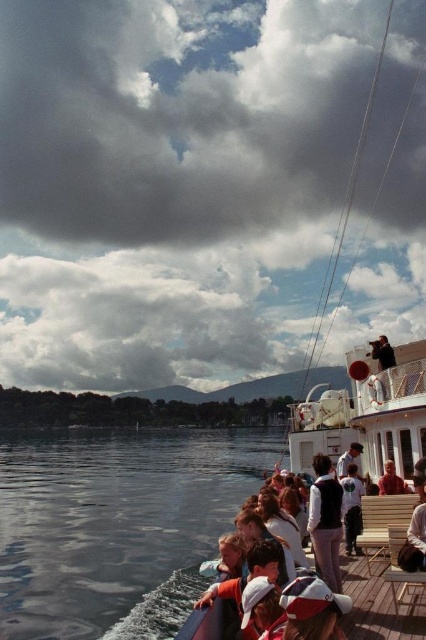
Question: Which object is the farthest from the clear water at lower left?

Choices:
 (A) wooden deck boat at center
 (B) wooden deck at center
 (C) white cotton shirt at center
 (D) red velvet coat at center

Answer: (D)

Question: Is clear water at lower left smaller than red velvet coat at center?

Choices:
 (A) no
 (B) yes

Answer: (A)

Question: Which of these objects is positioned farthest from the wooden deck boat at center?

Choices:
 (A) white cotton shirt at center
 (B) wooden deck at center
 (C) clear water at lower left

Answer: (C)

Question: Does wooden deck boat at center have a smaller size compared to white cotton shirt at center?

Choices:
 (A) no
 (B) yes

Answer: (A)

Question: Which of the following is the closest to the observer?

Choices:
 (A) (388, 483)
 (B) (215, 509)
 (C) (420, 604)
 (D) (340, 506)

Answer: (C)

Question: Does wooden deck boat at center have a smaller size compared to white cotton shirt at center?

Choices:
 (A) yes
 (B) no

Answer: (B)